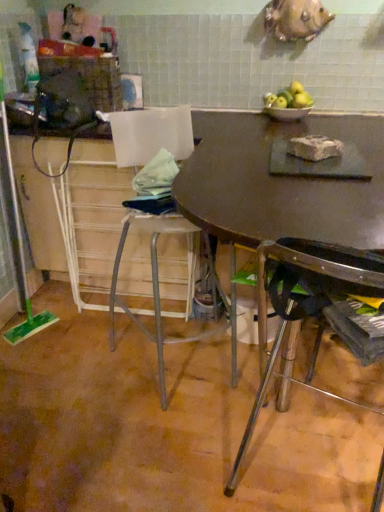
This screenshot has width=384, height=512. In order to click on free space to the left of white crumbly block at center in this screenshot , I will do `click(246, 156)`.